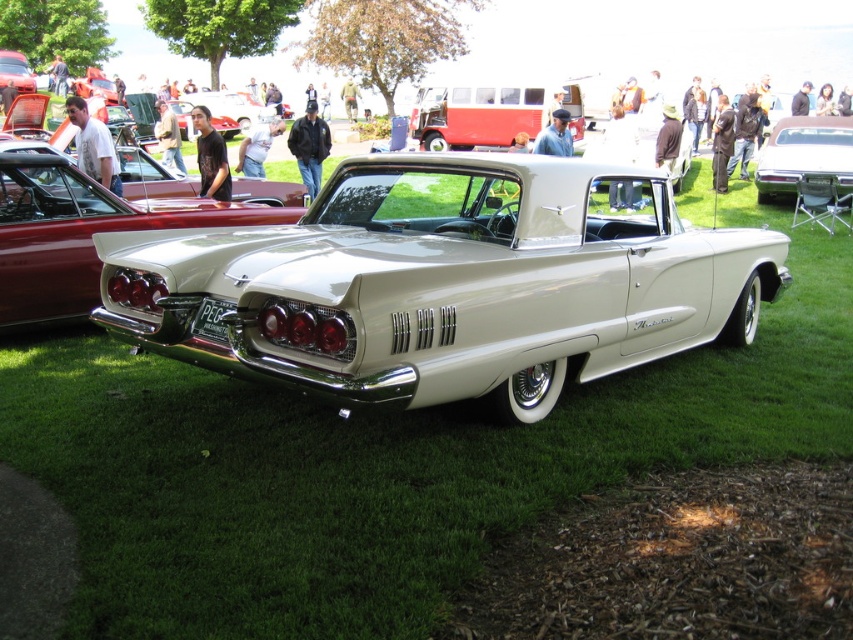
Is the position of shiny white convertible at center less distant than that of shiny white car at center?

Yes, shiny white convertible at center is closer to the viewer.

Is shiny white convertible at center to the right of shiny white car at center from the viewer's perspective?

Correct, you'll find shiny white convertible at center to the right of shiny white car at center.

The height and width of the screenshot is (640, 853). What do you see at coordinates (445, 284) in the screenshot?
I see `shiny white convertible at center` at bounding box center [445, 284].

Identify the location of shiny white convertible at center. (445, 284).

Looking at this image, between red matte van at upper center and shiny silver car at upper right, which one has less height?

With less height is red matte van at upper center.

Between point (479, 100) and point (831, 129), which one is positioned in front?

Point (831, 129)

Image resolution: width=853 pixels, height=640 pixels. What are the coordinates of `red matte van at upper center` in the screenshot? It's located at (488, 113).

Is shiny white convertible at center positioned in front of red matte van at upper center?

That is True.

In the scene shown: Can you confirm if shiny white convertible at center is wider than red matte van at upper center?

Yes, shiny white convertible at center is wider than red matte van at upper center.

Find the location of a particular element. shiny white convertible at center is located at coordinates (445, 284).